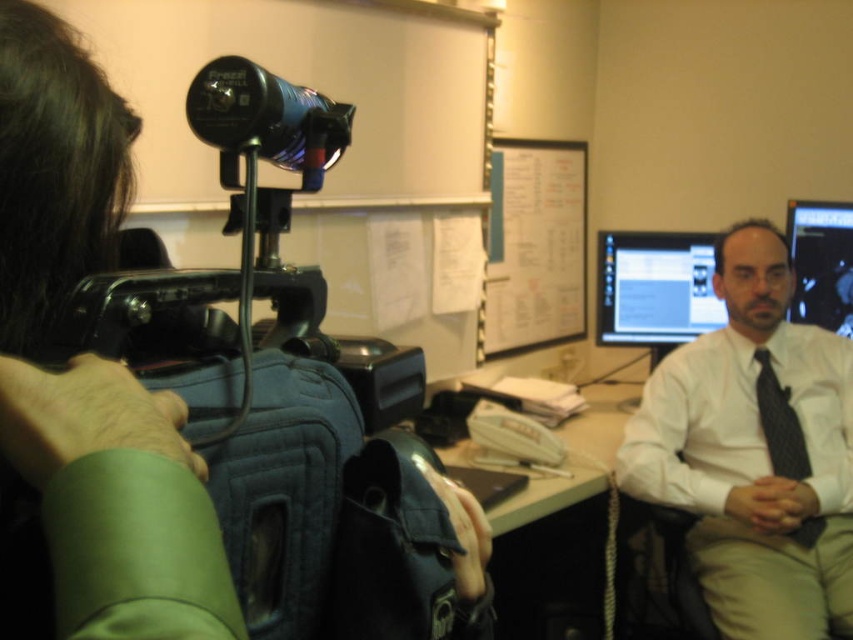
Can you confirm if white shirt at center is positioned to the left of dark gray textured tie at center right?

Indeed, white shirt at center is positioned on the left side of dark gray textured tie at center right.

Is white shirt at center above dark gray textured tie at center right?

Yes.

At what (x,y) coordinates should I click in order to perform the action: click on white shirt at center. Please return your answer as a coordinate pair (x, y). Looking at the image, I should click on (755, 451).

Can you confirm if white shirt at center is thinner than white glossy table at center?

Yes, white shirt at center is thinner than white glossy table at center.

Who is more forward, (747, 227) or (578, 444)?

Point (747, 227)

Does point (650, 396) come in front of point (561, 432)?

Yes.

Identify the location of white shirt at center. (755, 451).

Who is positioned more to the right, white glossy table at center or black glossy monitor at upper right?

From the viewer's perspective, black glossy monitor at upper right appears more on the right side.

Who is more distant from viewer, (608, 468) or (817, 225)?

Positioned behind is point (817, 225).

Locate an element on the screen. The width and height of the screenshot is (853, 640). white glossy table at center is located at coordinates (573, 458).